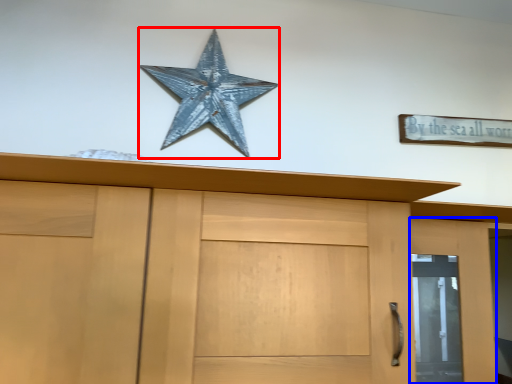
Question: Which object is closer to the camera taking this photo, starfish (highlighted by a red box) or door (highlighted by a blue box)?

Choices:
 (A) starfish
 (B) door

Answer: (B)